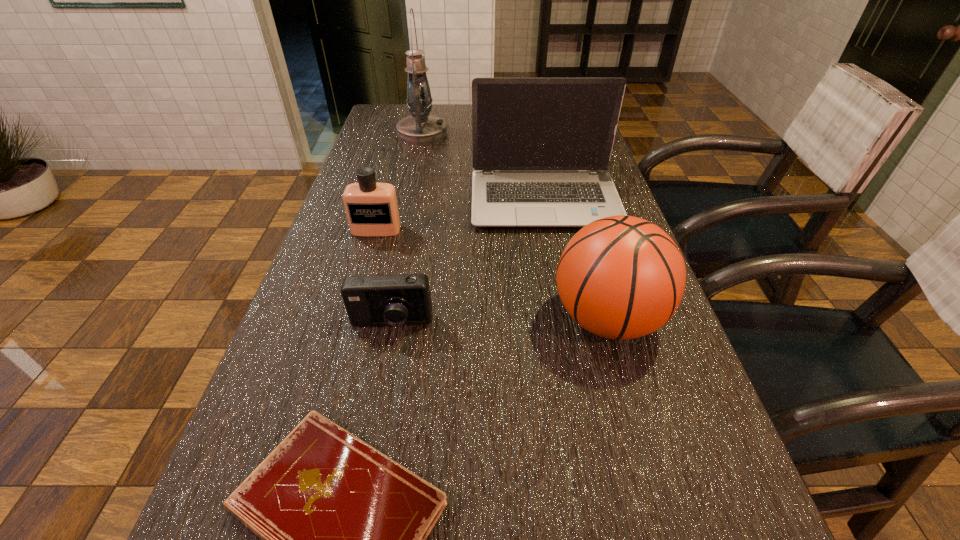
Locate an element on the screen. free space at the right edge of the desktop is located at coordinates (644, 467).

The image size is (960, 540). I want to click on vacant space that is in between the fourth tallest object and the fifth shortest object, so click(x=461, y=215).

Locate an element on the screen. This screenshot has width=960, height=540. free point between the second shortest object and the oil lamp is located at coordinates (407, 229).

What are the coordinates of `blank region between the fourth tallest object and the fifth shortest object` in the screenshot? It's located at (461, 215).

Identify the location of object that is the fifth closest to the third tallest object. This screenshot has height=540, width=960. click(x=421, y=128).

This screenshot has height=540, width=960. In order to click on object that stands as the third closest to the perfume in this screenshot , I will do `click(621, 277)`.

This screenshot has height=540, width=960. In order to click on free space in the image that satisfies the following two spatial constraints: 1. on the screen of the fifth shortest object; 2. on the left side of the basketball in this screenshot , I will do `click(567, 320)`.

Where is `vacant space that satisfies the following two spatial constraints: 1. on the screen of the second tallest object; 2. on the right side of the basketball`? This screenshot has height=540, width=960. vacant space that satisfies the following two spatial constraints: 1. on the screen of the second tallest object; 2. on the right side of the basketball is located at coordinates (567, 320).

Find the location of a particular element. This screenshot has height=540, width=960. vacant area that satisfies the following two spatial constraints: 1. on the front label of the fourth shortest object; 2. on the right side of the third shortest object is located at coordinates (350, 320).

In order to click on vacant space that satisfies the following two spatial constraints: 1. on the screen of the basketball; 2. on the right side of the laptop computer in this screenshot , I will do [567, 320].